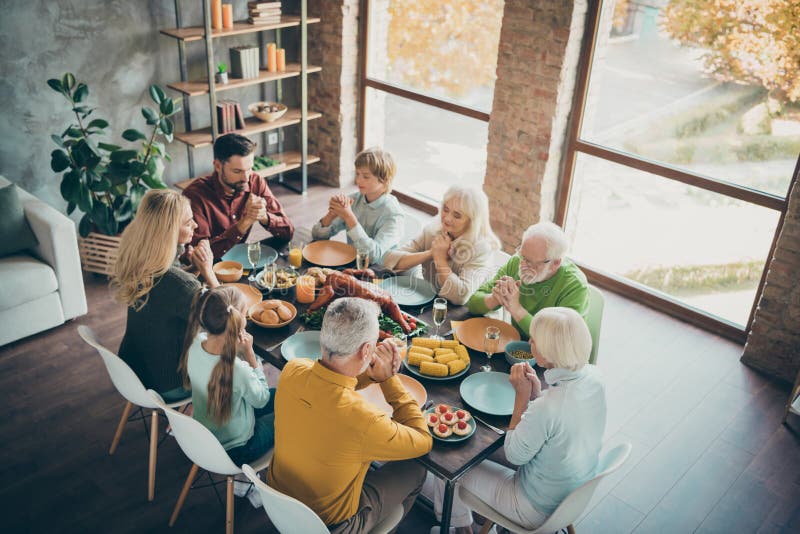
Where is `plates without food`? plates without food is located at coordinates (488, 386), (410, 290), (248, 260), (298, 347), (244, 300), (368, 391), (322, 252), (473, 326).